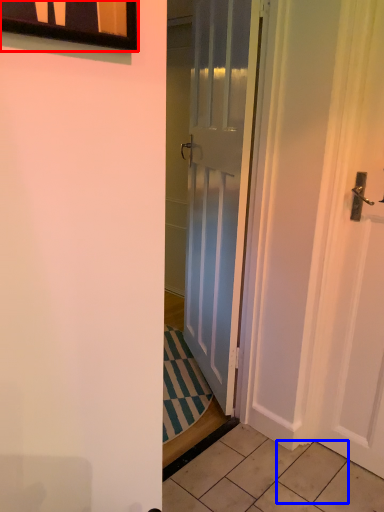
Question: Among these objects, which one is farthest to the camera, window (highlighted by a red box) or tile (highlighted by a blue box)?

Choices:
 (A) window
 (B) tile

Answer: (B)